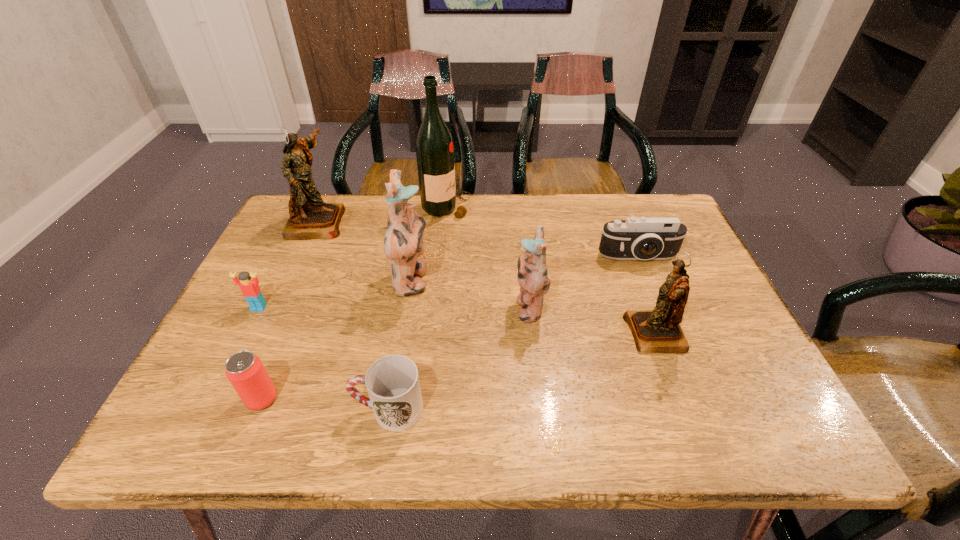
Image resolution: width=960 pixels, height=540 pixels. What are the coordinates of `vacant space that's between the red Lego and the camera` in the screenshot? It's located at (448, 282).

Identify the location of unoccupied position between the cup and the left pink figurine. (400, 346).

This screenshot has height=540, width=960. What are the coordinates of `empty space between the green wine bottle and the left pink figurine` in the screenshot? It's located at (429, 245).

I want to click on vacant area that lies between the smaller gold figurine and the cup, so click(x=522, y=372).

Where is `the third closest object relative to the bigger gold figurine`? the third closest object relative to the bigger gold figurine is located at coordinates (250, 289).

Identify which object is located as the second nearest to the red beer can. Please provide its 2D coordinates. Your answer should be formatted as a tuple, i.e. [(x, y)], where the tuple contains the x and y coordinates of a point satisfying the conditions above.

[(250, 289)]

Identify which figurine is the closest to the smaller pink figurine. Please provide its 2D coordinates. Your answer should be formatted as a tuple, i.e. [(x, y)], where the tuple contains the x and y coordinates of a point satisfying the conditions above.

[(655, 331)]

Locate an element on the screen. This screenshot has width=960, height=540. figurine that can be found as the second closest to the smaller pink figurine is located at coordinates (403, 243).

At what (x,y) coordinates should I click in order to perform the action: click on blank space that satisfies the following two spatial constraints: 1. on the front lens of the camera; 2. on the front-facing side of the third figurine from right to left. Please return your answer as a coordinate pair (x, y). This screenshot has height=540, width=960. Looking at the image, I should click on (648, 282).